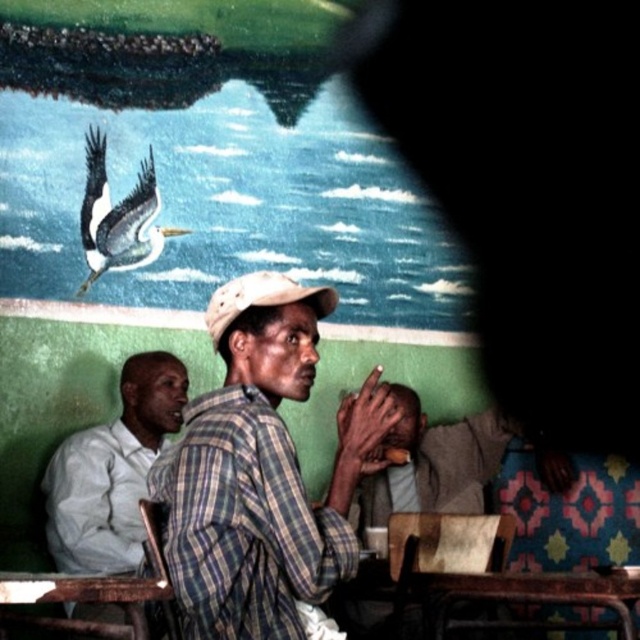
Can you confirm if plaid fabric shirt at center is thinner than white glossy pelican at upper center?

Incorrect, plaid fabric shirt at center's width is not less than white glossy pelican at upper center's.

Who is shorter, plaid fabric shirt at center or white glossy pelican at upper center?

white glossy pelican at upper center

The width and height of the screenshot is (640, 640). Describe the element at coordinates (260, 470) in the screenshot. I see `plaid fabric shirt at center` at that location.

At what (x,y) coordinates should I click in order to perform the action: click on plaid fabric shirt at center. Please return your answer as a coordinate pair (x, y). This screenshot has width=640, height=640. Looking at the image, I should click on (260, 470).

Measure the distance from white shirt at left to rusty metal table at lower left.

The distance of white shirt at left from rusty metal table at lower left is 4.29 feet.

Can you confirm if white shirt at left is positioned above rusty metal table at lower left?

Correct, white shirt at left is located above rusty metal table at lower left.

What do you see at coordinates (113, 470) in the screenshot? This screenshot has height=640, width=640. I see `white shirt at left` at bounding box center [113, 470].

The width and height of the screenshot is (640, 640). What are the coordinates of `white shirt at left` in the screenshot? It's located at (113, 470).

Based on the photo, is plaid fabric shirt at center above white shirt at left?

Correct, plaid fabric shirt at center is located above white shirt at left.

Between plaid fabric shirt at center and white shirt at left, which one appears on the right side from the viewer's perspective?

Positioned to the right is plaid fabric shirt at center.

Does point (237, 298) come farther from viewer compared to point (124, 412)?

No, it is not.

Where is `plaid fabric shirt at center`? The width and height of the screenshot is (640, 640). plaid fabric shirt at center is located at coordinates (260, 470).